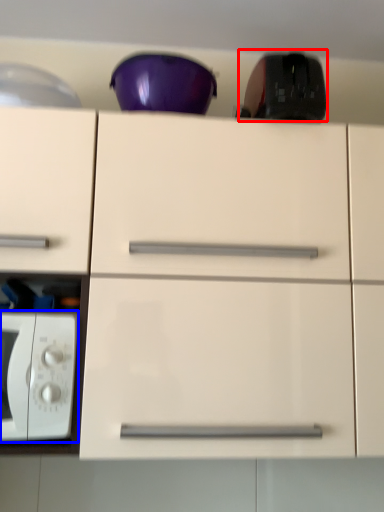
Question: Which object appears farthest to the camera in this image, appliance (highlighted by a red box) or microwave oven (highlighted by a blue box)?

Choices:
 (A) appliance
 (B) microwave oven

Answer: (A)